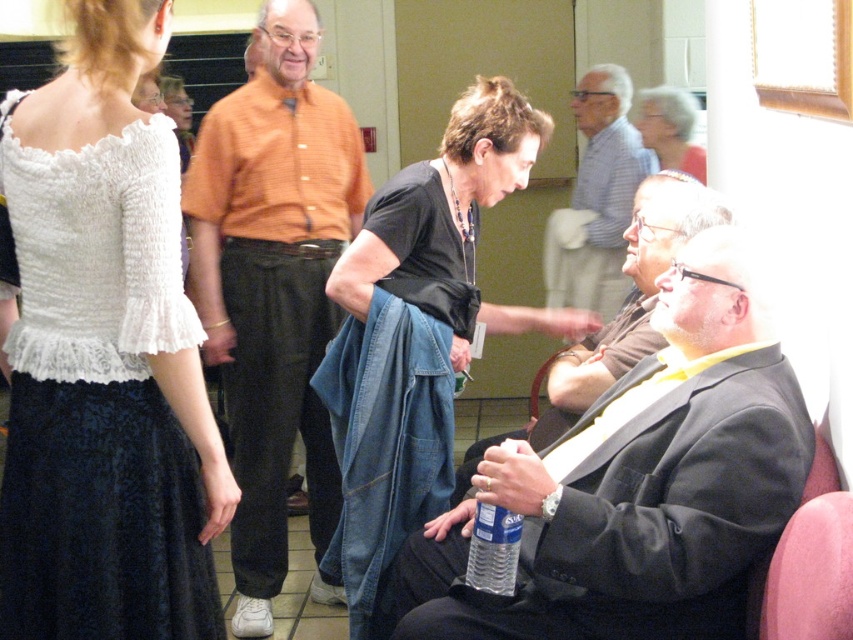
Between gray striped shirt at upper center and gray hair at upper right, which one has less height?

Standing shorter between the two is gray hair at upper right.

The image size is (853, 640). I want to click on gray striped shirt at upper center, so click(x=596, y=198).

The image size is (853, 640). I want to click on gray striped shirt at upper center, so click(x=596, y=198).

Does orange striped shirt at center have a lesser height compared to black jersey at center?

No, orange striped shirt at center is not shorter than black jersey at center.

Can you confirm if orange striped shirt at center is smaller than black jersey at center?

Correct, orange striped shirt at center occupies less space than black jersey at center.

I want to click on orange striped shirt at center, so (273, 285).

In order to click on orange striped shirt at center in this screenshot , I will do `click(273, 285)`.

Which of these two, orange striped shirt at center or gray hair at upper right, stands taller?

orange striped shirt at center

Is orange striped shirt at center smaller than gray hair at upper right?

No, orange striped shirt at center is not smaller than gray hair at upper right.

Is point (281, 538) positioned after point (680, 138)?

No, (281, 538) is in front of (680, 138).

Where is `orange striped shirt at center`? This screenshot has width=853, height=640. orange striped shirt at center is located at coordinates (273, 285).